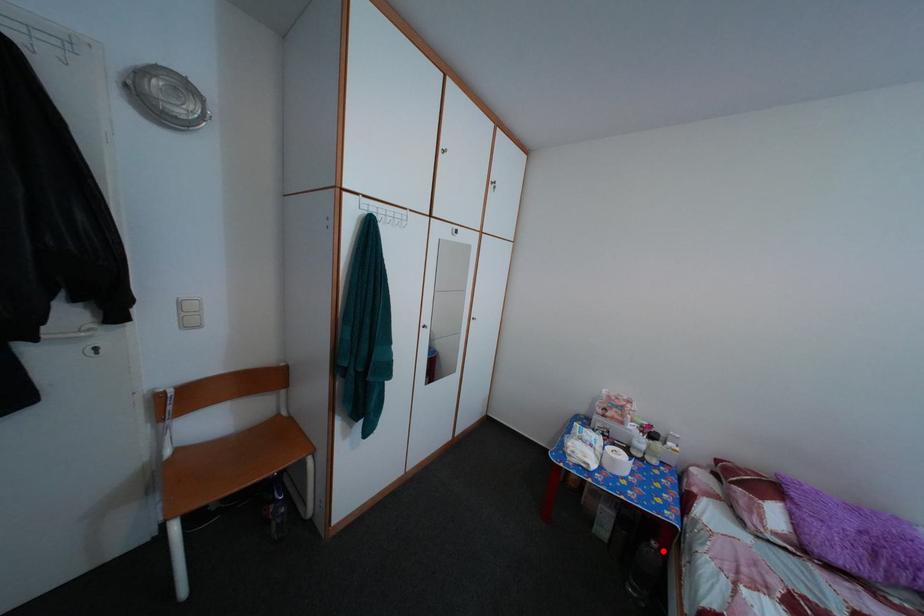
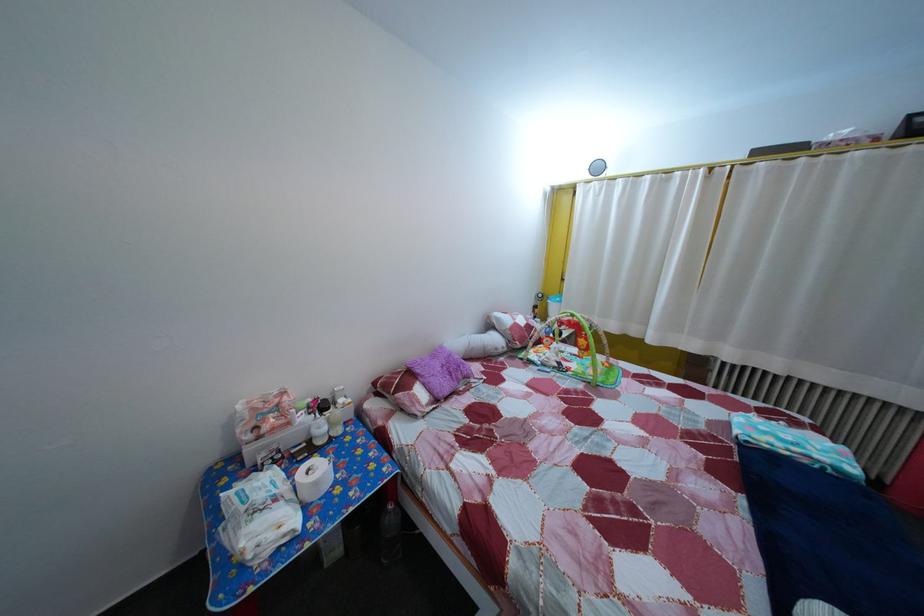
Locate, in the second image, the point that corresponds to the highlighted location in the first image.

(399, 515)